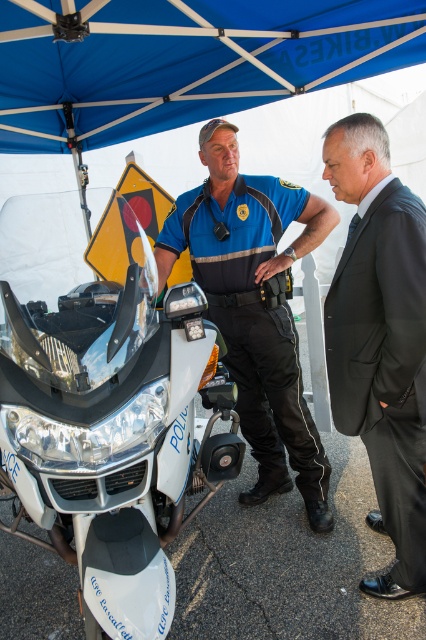
Question: Estimate the real-world distances between objects in this image. Which object is farther from the blue fabric canopy at upper center?

Choices:
 (A) blue uniform at center
 (B) black suit at right

Answer: (B)

Question: Is white glossy motorcycle at center smaller than blue fabric canopy at upper center?

Choices:
 (A) yes
 (B) no

Answer: (A)

Question: Which point is farther to the camera?

Choices:
 (A) (299, 380)
 (B) (406, 296)
 (C) (8, 83)
 (D) (100, 460)

Answer: (C)

Question: Which of the following is the closest to the observer?

Choices:
 (A) (181, 106)
 (B) (255, 224)
 (C) (17, 486)

Answer: (C)

Question: Does blue fabric canopy at upper center come behind blue uniform at center?

Choices:
 (A) no
 (B) yes

Answer: (A)

Question: Can you confirm if white glossy motorcycle at center is positioned below blue fabric canopy at upper center?

Choices:
 (A) no
 (B) yes

Answer: (B)